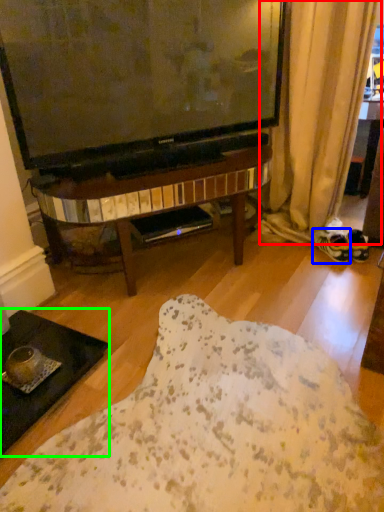
Question: Which is nearer to the curtain (highlighted by a red box)? footwear (highlighted by a blue box) or coffee table (highlighted by a green box).

Choices:
 (A) footwear
 (B) coffee table

Answer: (A)